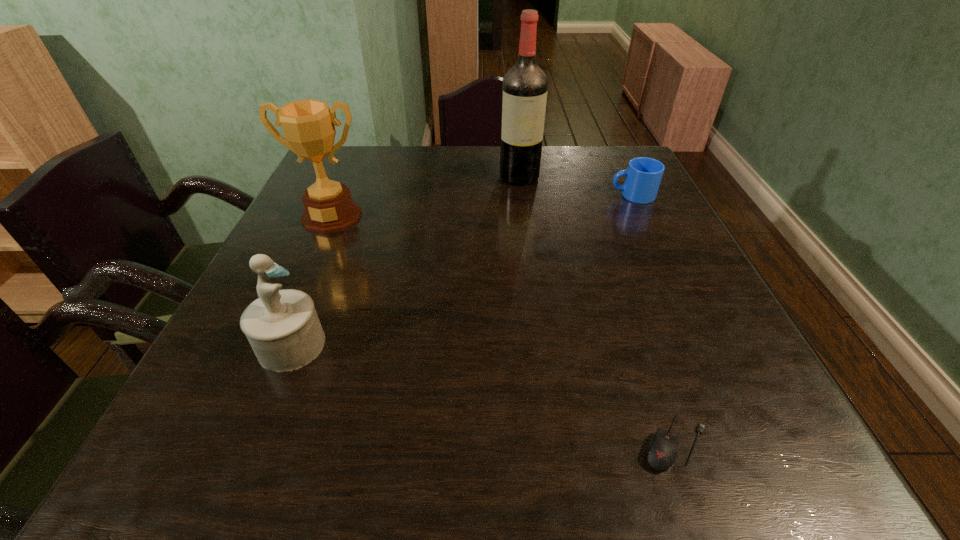
I want to click on free space located 0.360m on the front-facing side of the fourth shortest object, so click(271, 354).

Locate an element on the screen. Image resolution: width=960 pixels, height=540 pixels. free spot located 0.210m at the beak of the second nearest object is located at coordinates (440, 345).

The width and height of the screenshot is (960, 540). Identify the location of vacant space located 0.390m on the side of the second shortest object with the handle. (464, 195).

Locate an element on the screen. The width and height of the screenshot is (960, 540). vacant space located on the side of the second shortest object with the handle is located at coordinates (491, 195).

Find the location of a particular element. vacant region located 0.160m on the side of the second shortest object with the handle is located at coordinates (550, 195).

Identify the location of vacant region located 0.270m on the left of the nearest object. The width and height of the screenshot is (960, 540). (460, 443).

Image resolution: width=960 pixels, height=540 pixels. Find the location of `object present at the far edge`. object present at the far edge is located at coordinates (524, 88).

You are a GUI agent. You are given a task and a screenshot of the screen. Output one action in this format:
    pyautogui.click(x=<x>, y=<y>)
    Task: Click on the object at the near edge
    The image size is (960, 540).
    Given the screenshot: What is the action you would take?
    pyautogui.click(x=662, y=453)

I want to click on award that is at the left edge, so coord(308,125).

This screenshot has width=960, height=540. What are the coordinates of `figurine that is at the left edge` in the screenshot? It's located at (282, 326).